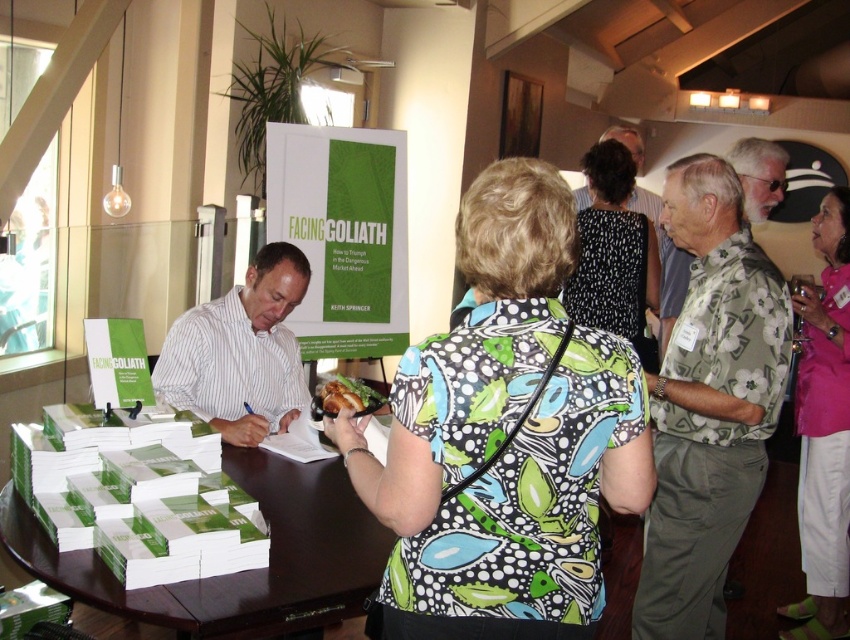
Question: Which object appears farthest from the camera in this image?

Choices:
 (A) black dotted dress at center
 (B) pink fabric shirt at upper right

Answer: (B)

Question: Which point is farther to the camera?

Choices:
 (A) hawaiian shirt at center
 (B) white striped shirt at left
 (C) printed fabric blouse at center
 (D) pink fabric shirt at upper right

Answer: (D)

Question: Which object is positioned closest to the pink fabric shirt at upper right?

Choices:
 (A) black dotted dress at center
 (B) floral print shirt at center
 (C) printed fabric blouse at center
 (D) white striped shirt at left

Answer: (A)

Question: Can you confirm if green paper stacks at center is thinner than pink fabric shirt at upper right?

Choices:
 (A) yes
 (B) no

Answer: (B)

Question: Is floral print shirt at center thinner than white striped shirt at left?

Choices:
 (A) yes
 (B) no

Answer: (A)

Question: Is white striped shirt at left in front of hawaiian shirt at center?

Choices:
 (A) no
 (B) yes

Answer: (B)